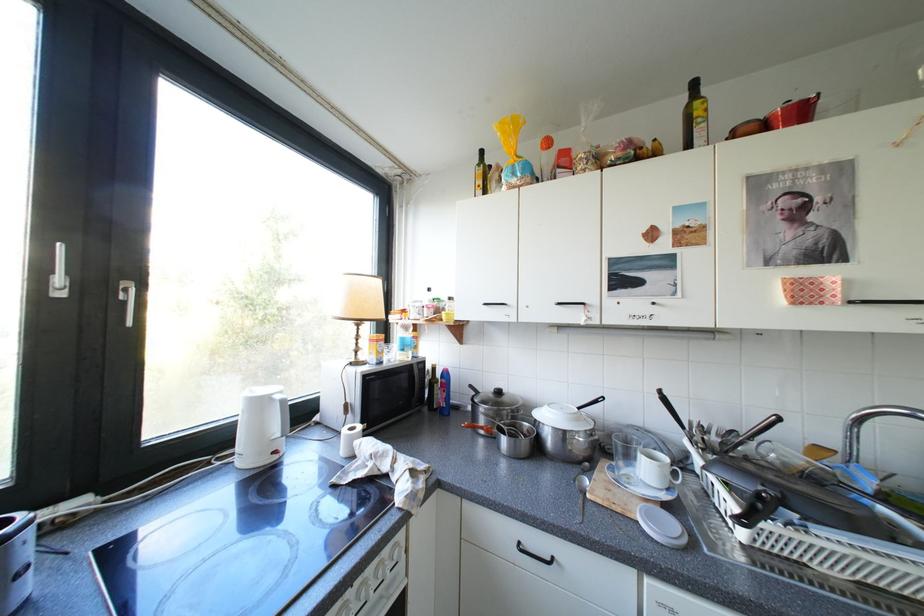
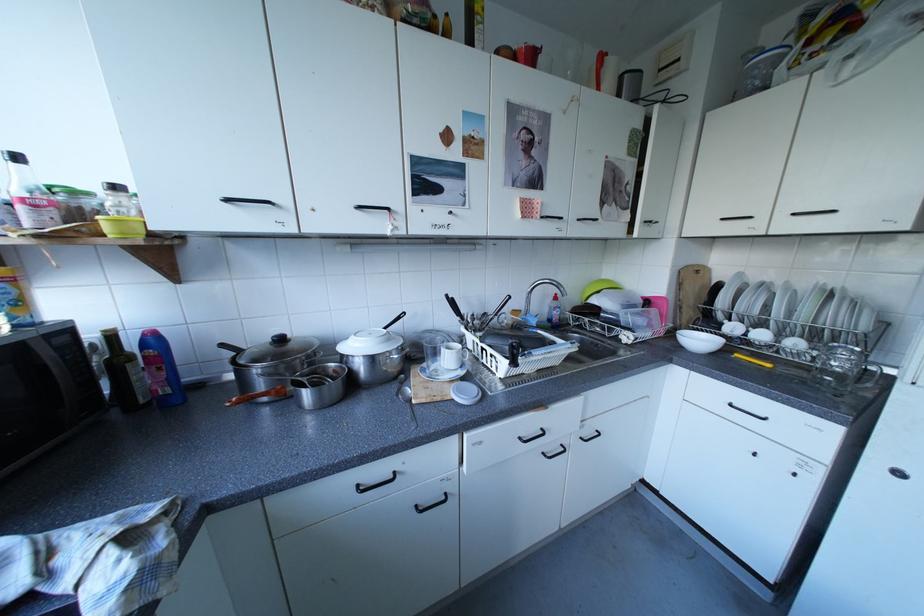
In the second image, find the point that corresponds to pixel 638 469 in the first image.

(445, 367)